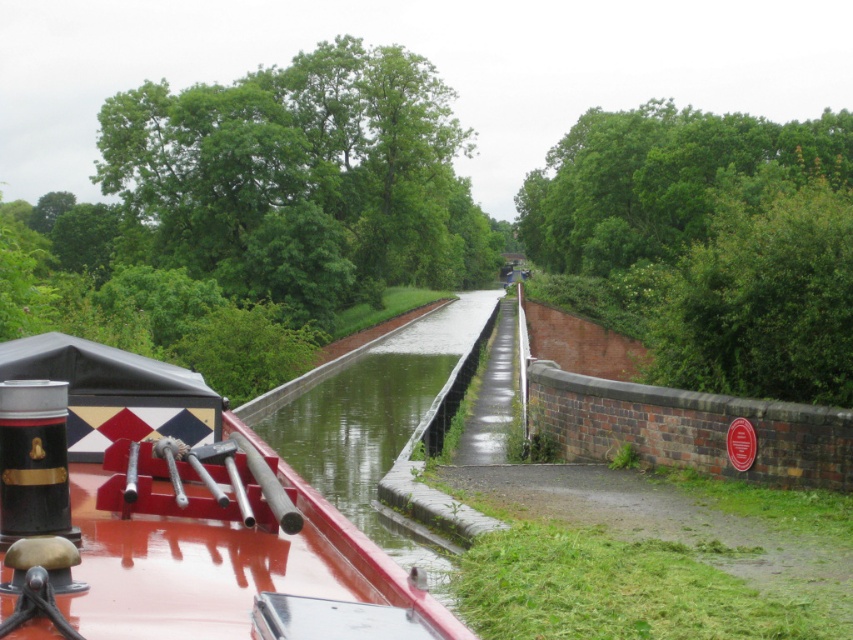
Question: In this image, where is shiny red boat at center located relative to green leafy tree at upper center?

Choices:
 (A) below
 (B) above

Answer: (A)

Question: Which point is farther from the camera taking this photo?

Choices:
 (A) (712, 168)
 (B) (102, 529)

Answer: (A)

Question: Which object is the farthest from the green leafy tree at upper left?

Choices:
 (A) green concrete canal at center
 (B) shiny red boat at center
 (C) green leafy tree at upper center

Answer: (B)

Question: Which point is closer to the camera?

Choices:
 (A) (222, 456)
 (B) (584, 230)
 (C) (184, 125)
 (D) (413, 330)

Answer: (A)

Question: Is green leafy tree at upper center smaller than green concrete canal at center?

Choices:
 (A) yes
 (B) no

Answer: (B)

Question: Is green leafy tree at upper center behind green concrete canal at center?

Choices:
 (A) yes
 (B) no

Answer: (A)